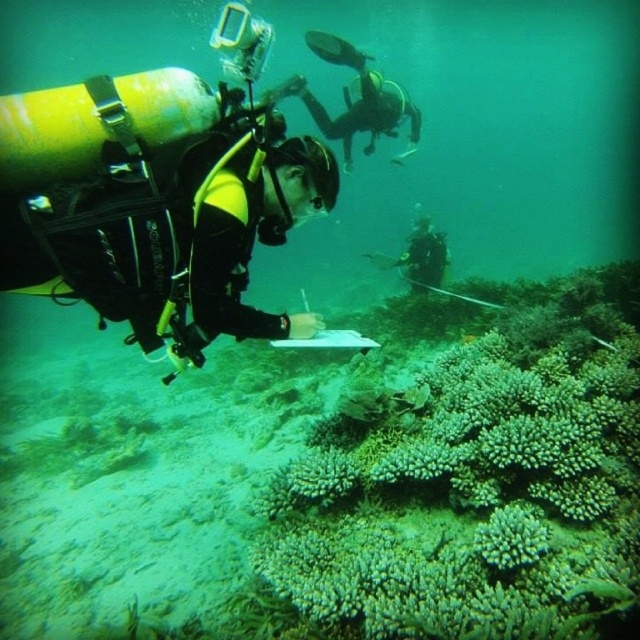
You are a marine biologist planning to place a buoy at point 0.367, 0.291. Is the yellow matte wetsuit at center in the way of this placement?

The yellow matte wetsuit at center is located exactly at point (x=186, y=234), so it would be in the way of placing the buoy there.

You are a marine biologist planning to take a photo of the shiny silver fish at upper center while avoiding the black scuba diver at center. Given that your camera has a 5 feet focal range, can you capture the fish without the diver appearing in the frame?

The black scuba diver at center and shiny silver fish at upper center are 9.07 feet apart. Since your camera has a 5 feet focal range, the distance between them is greater than the focal range. Therefore, you can capture the fish without the diver appearing in the frame.

You are a marine biologist observing underwater. You notice a yellow matte wetsuit at center and a shiny silver fish at upper center. Which object is wider in this underwater scene?

The yellow matte wetsuit at center might be wider than shiny silver fish at upper center according to the description.